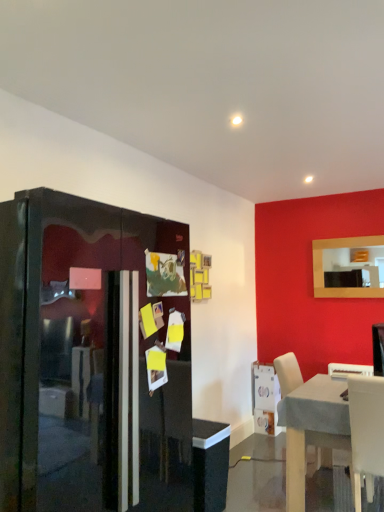
At what (x,y) coordinates should I click in order to perform the action: click on vacant space situated above white plastic chair at lower right, marked as the 1th chair in a top-to-bottom arrangement (from a real-world perspective). Please return your answer as a coordinate pair (x, y). The image size is (384, 512). Looking at the image, I should click on (344, 367).